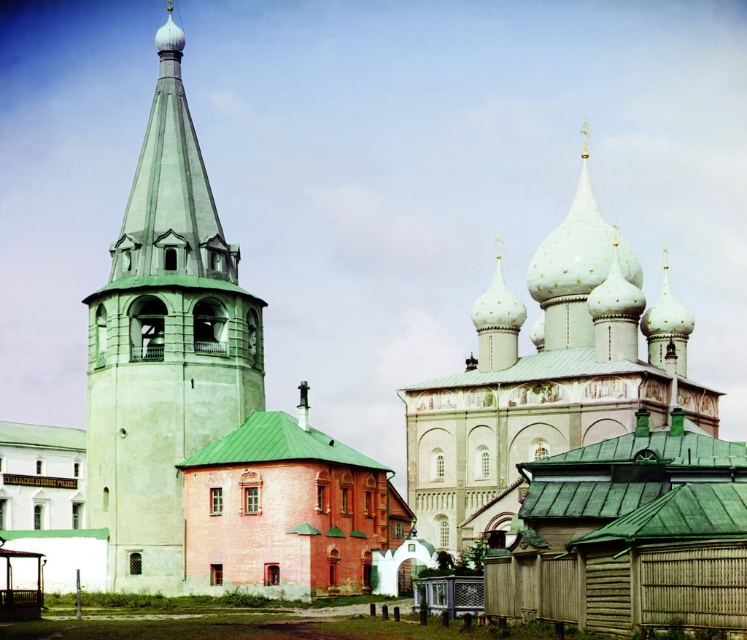
Which of these two, green tiled bell tower at left or white painted stone tower at upper center, stands taller?

green tiled bell tower at left

Between green tiled bell tower at left and white painted stone tower at upper center, which one is positioned higher?

green tiled bell tower at left is higher up.

Who is more distant from viewer, (249, 403) or (588, 296)?

Point (588, 296)

In order to click on green tiled bell tower at left in this screenshot , I will do `click(164, 344)`.